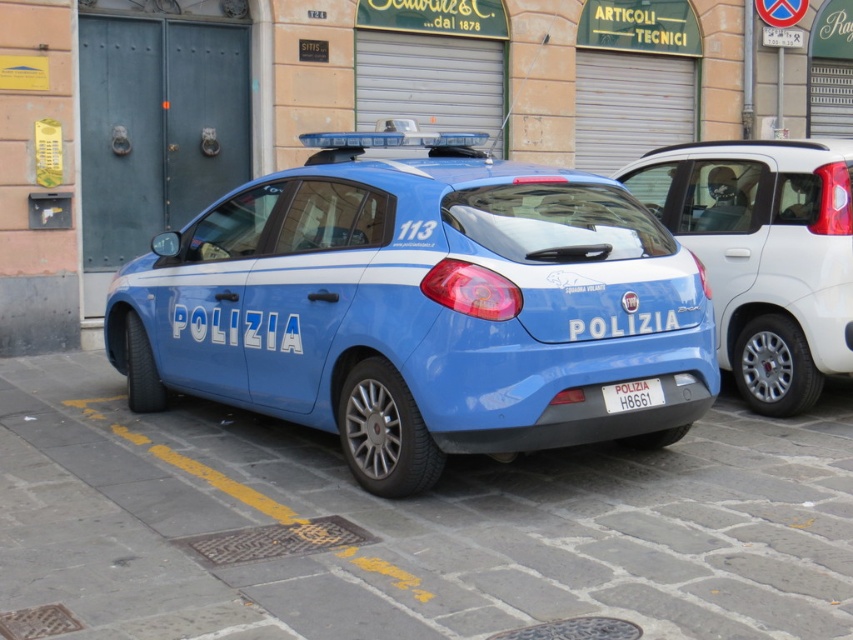
Question: Can you confirm if blue glossy car at center is bigger than white plastic license plate at center?

Choices:
 (A) no
 (B) yes

Answer: (B)

Question: Is matte blue car at center wider than white plastic license plate at center?

Choices:
 (A) yes
 (B) no

Answer: (A)

Question: Which point is farther to the camera?

Choices:
 (A) blue glossy car at center
 (B) matte blue car at center

Answer: (A)

Question: Can you confirm if matte blue car at center is bigger than white plastic license plate at center?

Choices:
 (A) no
 (B) yes

Answer: (B)

Question: Which of the following is the closest to the observer?

Choices:
 (A) blue glossy car at center
 (B) white plastic license plate at center
 (C) matte blue car at center

Answer: (C)

Question: Which object is positioned farthest from the blue glossy car at center?

Choices:
 (A) matte blue car at center
 (B) white plastic license plate at center

Answer: (A)